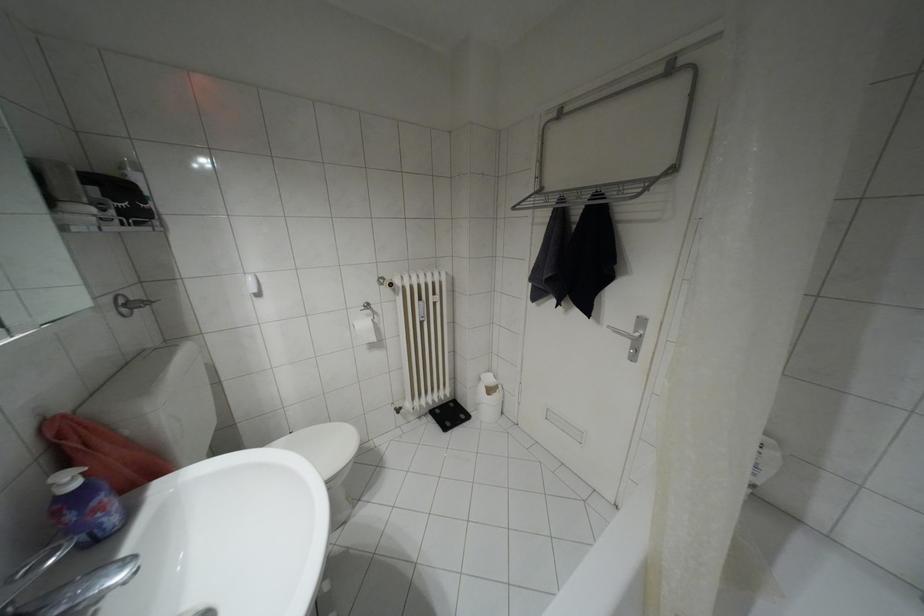
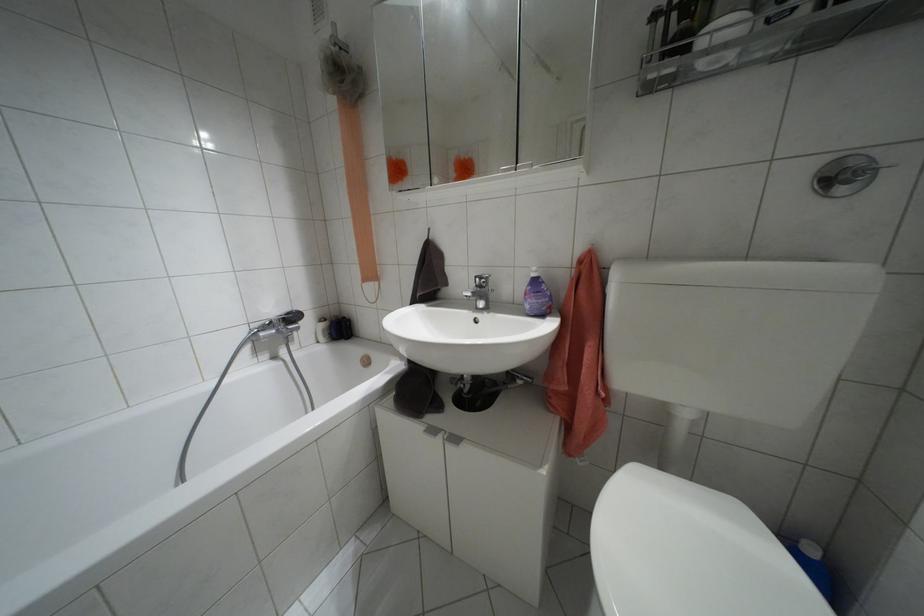
Where in the second image is the point corresponding to [75,484] from the first image?

(532, 274)